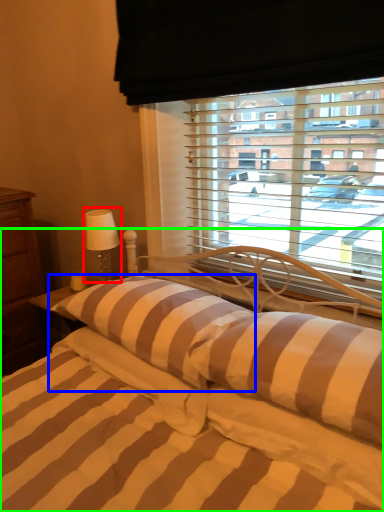
Question: Which object is the farthest from table lamp (highlighted by a red box)? Choose among these: pillow (highlighted by a blue box) or bed (highlighted by a green box).

Choices:
 (A) pillow
 (B) bed

Answer: (B)